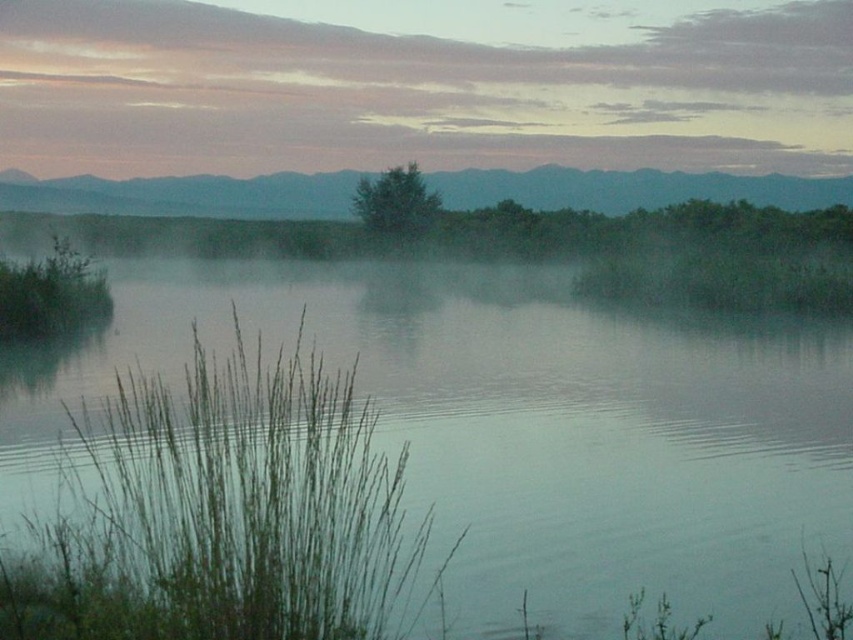
You are standing at the edge of the green grass at left and want to cross to the green grassy river at center. Considering the height difference between them, which direction should you walk to ascend?

The green grassy river at center has a greater height compared to the green grass at left, so you should walk towards the green grassy river at center to ascend.

You are an artist trying to sketch this scene. You want to ensure the pastel sky clouds at upper center and the green matte tree at center are proportionate. Which object should you draw larger?

The pastel sky clouds at upper center should be drawn larger than the green matte tree at center because the description states that the pastel sky clouds at upper center is bigger than the green matte tree at center.